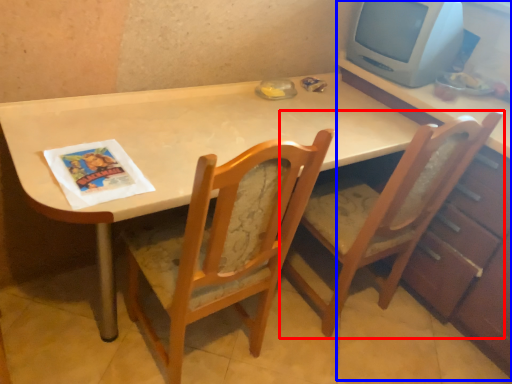
Question: Which object appears farthest to the camera in this image, chair (highlighted by a red box) or dresser (highlighted by a blue box)?

Choices:
 (A) chair
 (B) dresser

Answer: (B)